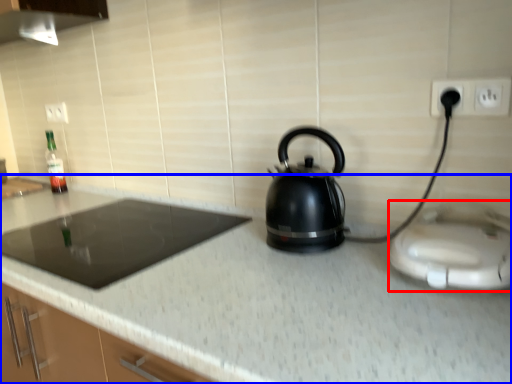
Question: Which point is closer to the camera, appliance (highlighted by a red box) or countertop (highlighted by a blue box)?

Choices:
 (A) appliance
 (B) countertop

Answer: (B)